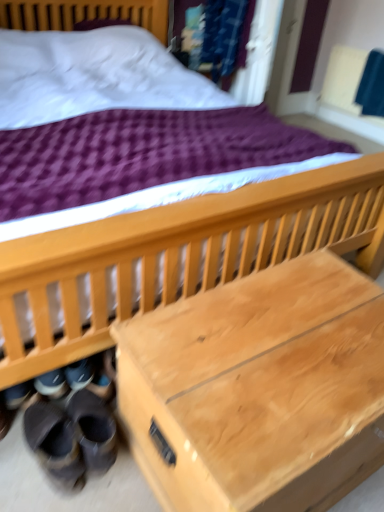
Question: Is natural wood trunk at lower center in contact with leather-like brown shoes at lower left, which is the first footwear in left-to-right order?

Choices:
 (A) no
 (B) yes

Answer: (A)

Question: Does natural wood trunk at lower center come behind leather-like brown shoes at lower left, which ranks as the 2th footwear in right-to-left order?

Choices:
 (A) no
 (B) yes

Answer: (A)

Question: Can you confirm if natural wood trunk at lower center is positioned to the right of leather-like brown shoes at lower left, which is the first footwear in left-to-right order?

Choices:
 (A) no
 (B) yes

Answer: (B)

Question: From a real-world perspective, is natural wood trunk at lower center on leather-like brown shoes at lower left, which is the first footwear in left-to-right order?

Choices:
 (A) no
 (B) yes

Answer: (B)

Question: Is natural wood trunk at lower center outside leather-like brown shoes at lower left, which is the first footwear in left-to-right order?

Choices:
 (A) yes
 (B) no

Answer: (A)

Question: Considering the relative positions of natural wood trunk at lower center and leather-like brown shoes at lower left, which is the first footwear in left-to-right order, in the image provided, is natural wood trunk at lower center to the left of leather-like brown shoes at lower left, which is the first footwear in left-to-right order, from the viewer's perspective?

Choices:
 (A) yes
 (B) no

Answer: (B)

Question: Is leather-like brown shoes at lower left, which is the first footwear in left-to-right order, completely or partially outside of black suede shoes at lower left, the first footwear from the right?

Choices:
 (A) yes
 (B) no

Answer: (A)

Question: From a real-world perspective, is leather-like brown shoes at lower left, which ranks as the 2th footwear in right-to-left order, positioned under black suede shoes at lower left, the first footwear from the right, based on gravity?

Choices:
 (A) yes
 (B) no

Answer: (B)

Question: Is leather-like brown shoes at lower left, which ranks as the 2th footwear in right-to-left order, positioned behind black suede shoes at lower left, the first footwear from the right?

Choices:
 (A) no
 (B) yes

Answer: (A)

Question: Is there a large distance between leather-like brown shoes at lower left, which is the first footwear in left-to-right order, and black suede shoes at lower left, arranged as the 2th footwear when viewed from the left?

Choices:
 (A) no
 (B) yes

Answer: (A)

Question: Considering the relative positions of leather-like brown shoes at lower left, which ranks as the 2th footwear in right-to-left order, and black suede shoes at lower left, the first footwear from the right, in the image provided, is leather-like brown shoes at lower left, which ranks as the 2th footwear in right-to-left order, to the right of black suede shoes at lower left, the first footwear from the right, from the viewer's perspective?

Choices:
 (A) yes
 (B) no

Answer: (B)

Question: Is leather-like brown shoes at lower left, which is the first footwear in left-to-right order, closer to the viewer compared to black suede shoes at lower left, the first footwear from the right?

Choices:
 (A) yes
 (B) no

Answer: (A)

Question: From a real-world perspective, is natural wood trunk at lower center under leather brown shoes at lower left?

Choices:
 (A) no
 (B) yes

Answer: (A)